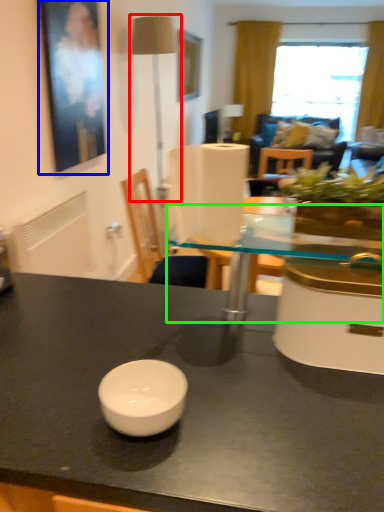
Question: Which object is the closest to the table lamp (highlighted by a red box)? Choose among these: picture frame (highlighted by a blue box) or round table (highlighted by a green box).

Choices:
 (A) picture frame
 (B) round table

Answer: (A)